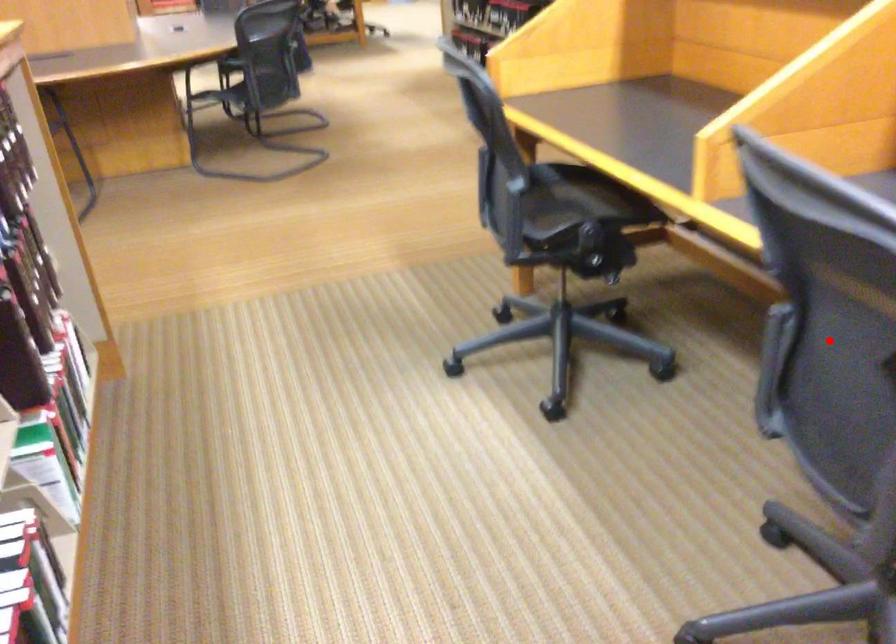
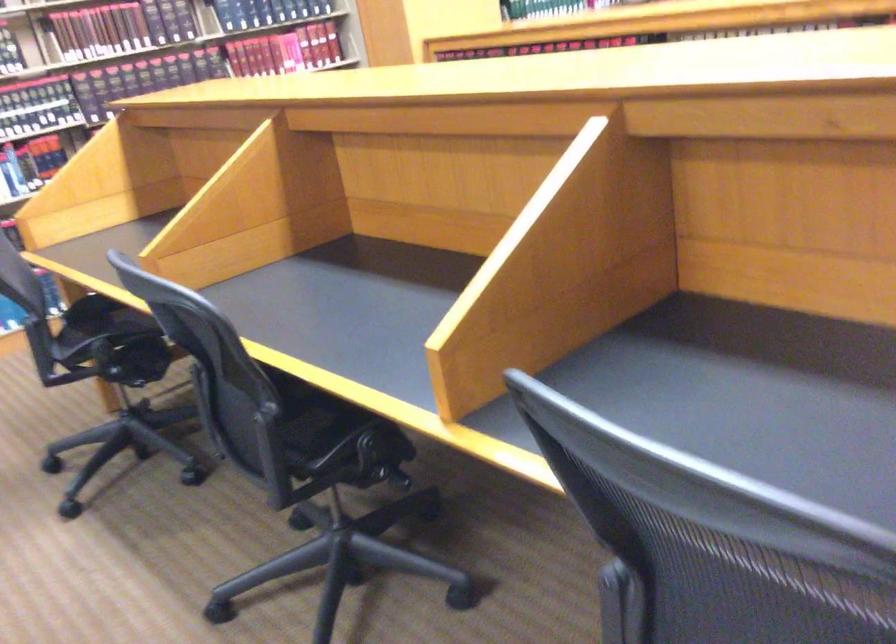
Question: I am providing you with two images of the same scene from different viewpoints. A red point is marked on the first image. Can you still see the location of the red point in image 2?

Choices:
 (A) Yes
 (B) No

Answer: (B)